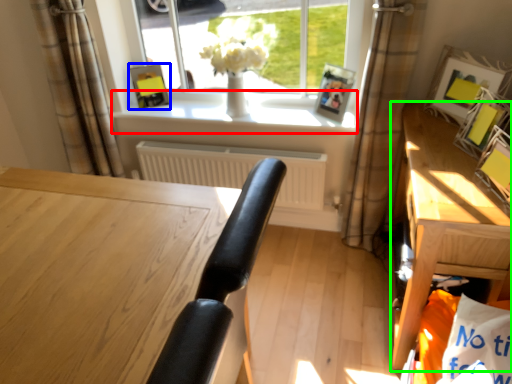
Question: Considering the real-world distances, which object is farthest from window sill (highlighted by a red box)? picture frame (highlighted by a blue box) or table (highlighted by a green box)?

Choices:
 (A) picture frame
 (B) table

Answer: (B)